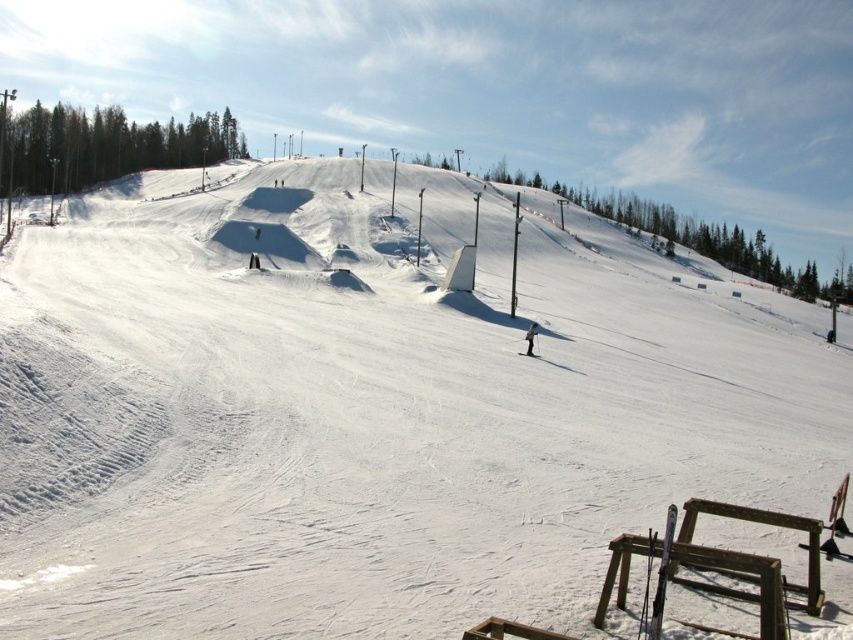
What do you see at coordinates (662, 576) in the screenshot? I see `matte black ski at lower right` at bounding box center [662, 576].

Does matte black ski at lower right have a lesser width compared to black matte skier at center?

No.

In order to click on matte black ski at lower right in this screenshot , I will do `click(662, 576)`.

Where is `matte black ski at lower right`? This screenshot has width=853, height=640. matte black ski at lower right is located at coordinates (662, 576).